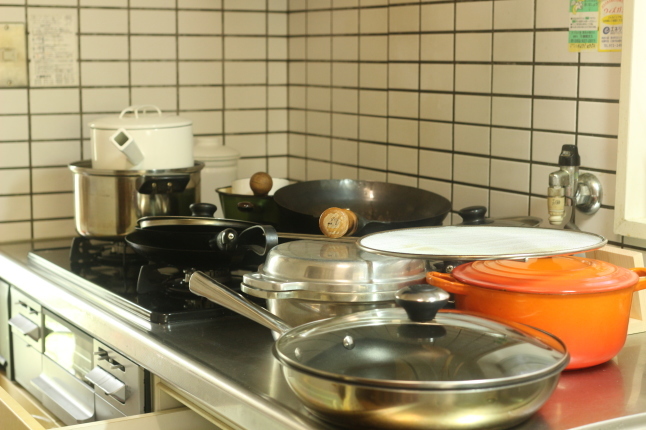
You are a GUI agent. You are given a task and a screenshot of the screen. Output one action in this format:
    pyautogui.click(x=<x>, y=<y>)
    Task: Click on the dishes
    This screenshot has width=646, height=430.
    Given the screenshot: What is the action you would take?
    pyautogui.click(x=474, y=356), pyautogui.click(x=544, y=303), pyautogui.click(x=328, y=289), pyautogui.click(x=346, y=201), pyautogui.click(x=191, y=233), pyautogui.click(x=251, y=196), pyautogui.click(x=134, y=191), pyautogui.click(x=148, y=130), pyautogui.click(x=513, y=241)